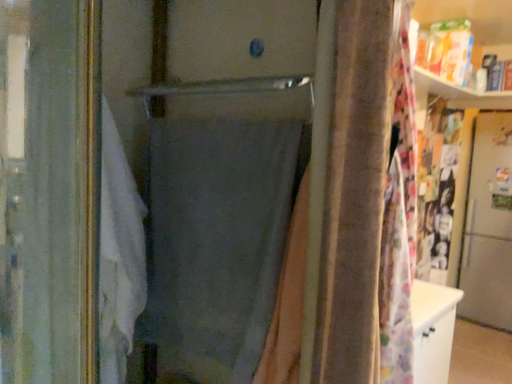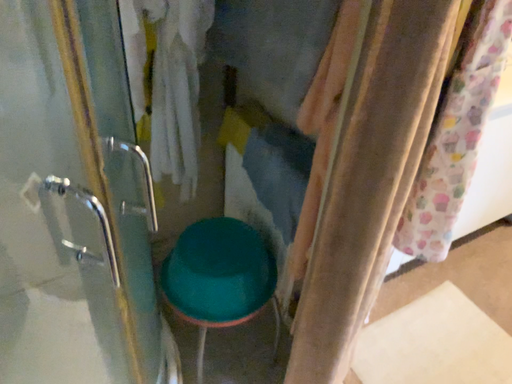
Question: Which way did the camera rotate in the video?

Choices:
 (A) rotated right
 (B) rotated left

Answer: (B)